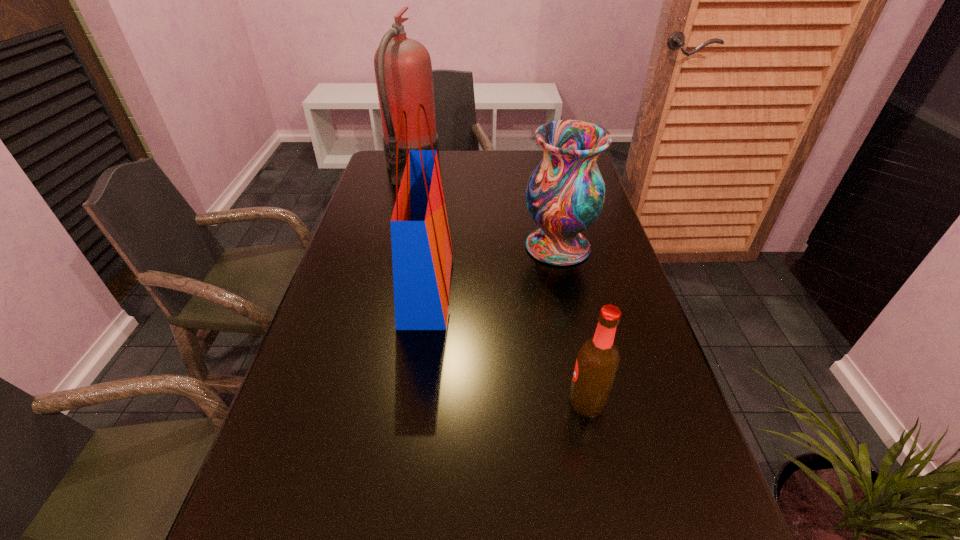
I want to click on free space between the shortest object and the vase, so click(572, 324).

You are a GUI agent. You are given a task and a screenshot of the screen. Output one action in this format:
    pyautogui.click(x=<x>, y=<y>)
    Task: Click on the empty location between the fire extinguisher and the second shortest object
    The width and height of the screenshot is (960, 540).
    Given the screenshot: What is the action you would take?
    pyautogui.click(x=485, y=207)

Locate an element on the screen. Image resolution: width=960 pixels, height=540 pixels. vacant space that is in between the farthest object and the third tallest object is located at coordinates (485, 207).

At what (x,y) coordinates should I click in order to perform the action: click on vacant space that is in between the second shortest object and the beer bottle. Please return your answer as a coordinate pair (x, y). This screenshot has height=540, width=960. Looking at the image, I should click on (572, 324).

Image resolution: width=960 pixels, height=540 pixels. Find the location of `empty location between the beer bottle and the shopping bag`. empty location between the beer bottle and the shopping bag is located at coordinates (507, 344).

At what (x,y) coordinates should I click in order to perform the action: click on vacant area between the fire extinguisher and the second shortest object. Please return your answer as a coordinate pair (x, y). The image size is (960, 540). Looking at the image, I should click on (485, 207).

You are a GUI agent. You are given a task and a screenshot of the screen. Output one action in this format:
    pyautogui.click(x=<x>, y=<y>)
    Task: Click on the object that can be found as the third closest to the farthest object
    The height and width of the screenshot is (540, 960).
    Given the screenshot: What is the action you would take?
    pyautogui.click(x=597, y=362)

Select which object is the second closest to the farthest object. Please provide its 2D coordinates. Your answer should be formatted as a tuple, i.e. [(x, y)], where the tuple contains the x and y coordinates of a point satisfying the conditions above.

[(565, 194)]

At what (x,y) coordinates should I click in order to perform the action: click on vacant position in the image that satisfies the following two spatial constraints: 1. on the handle side of the shopping bag; 2. on the back side of the beer bottle. Please return your answer as a coordinate pair (x, y). Image resolution: width=960 pixels, height=540 pixels. Looking at the image, I should click on (412, 401).

Identify the location of free space that satisfies the following two spatial constraints: 1. on the handle side of the shortest object; 2. on the left side of the shopping bag. This screenshot has width=960, height=540. (412, 401).